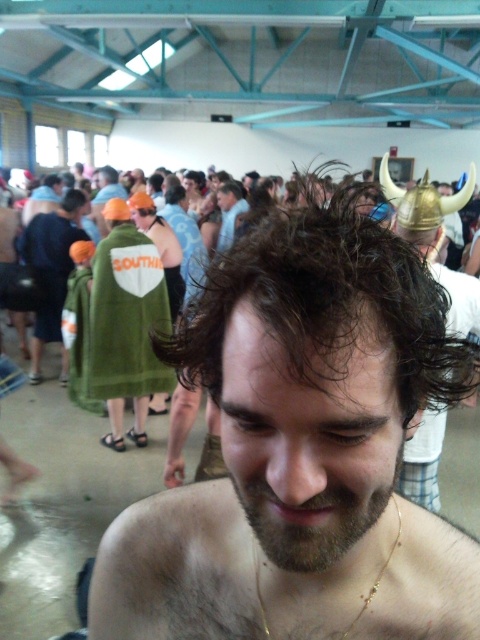
You are organizing a costume party and need to decide which headwear to place on a narrow shelf. The shelf can only accommodate items narrower than the matte black helmet at upper center. Based on the scene, can the orange fabric cap at upper left fit on the shelf?

The orange fabric cap at upper left has a width less than the matte black helmet at upper center, so it will fit on the shelf since it is narrower.

You are standing at the center of the event and want to move towards the two points marked in the image. Which point, point (342, 330) or point (256, 456), will you reach first?

Point (342, 330) is closer to the viewer than point (256, 456), so you will reach point (342, 330) first.